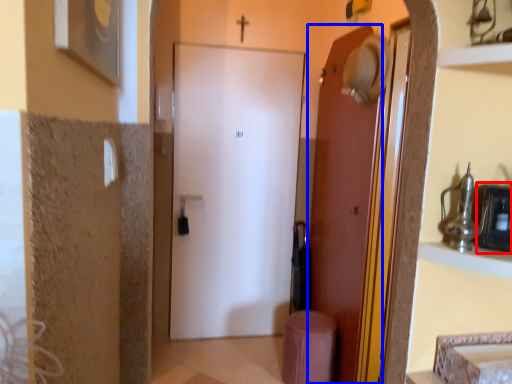
Question: Among these objects, which one is farthest to the camera, medicine cabinet (highlighted by a red box) or door (highlighted by a blue box)?

Choices:
 (A) medicine cabinet
 (B) door

Answer: (B)